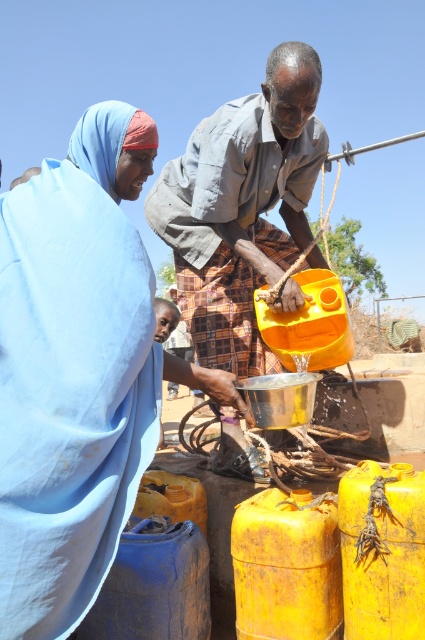
Question: Can you confirm if yellow matte barrel at lower center is positioned to the left of yellow matte plastic barrel at center?

Choices:
 (A) yes
 (B) no

Answer: (B)

Question: Observing the image, what is the correct spatial positioning of matte gray shirt at center in reference to rusty yellow barrel at center?

Choices:
 (A) below
 (B) above

Answer: (B)

Question: Among these points, which one is farthest from the camera?

Choices:
 (A) (105, 346)
 (B) (166, 192)

Answer: (B)

Question: Which point is farther from the camera taking this photo?

Choices:
 (A) (65, 364)
 (B) (274, 188)
 (C) (265, 320)

Answer: (B)

Question: Among these points, which one is farthest from the camera?

Choices:
 (A) (282, 556)
 (B) (127, 419)

Answer: (A)

Question: Where is rusty yellow barrel at center located in relation to yellow matte barrel at lower center in the image?

Choices:
 (A) left
 (B) right

Answer: (A)